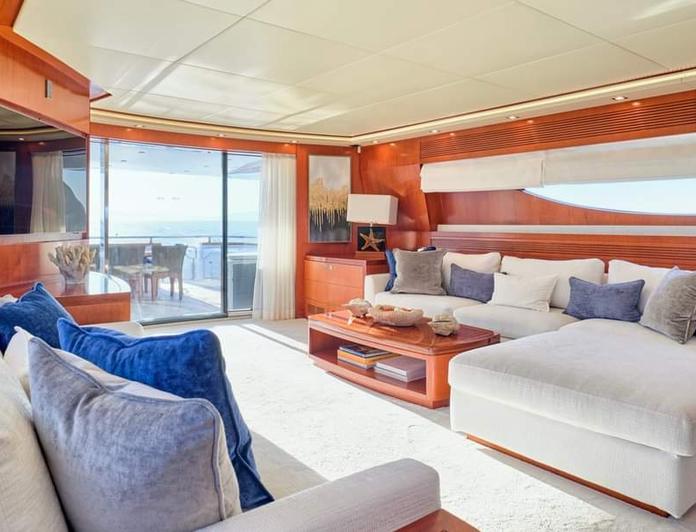
At what (x,y) coordinates should I click in order to perform the action: click on couch. Please return your answer as a coordinate pair (x, y). The image size is (696, 532). Looking at the image, I should click on (536, 285).